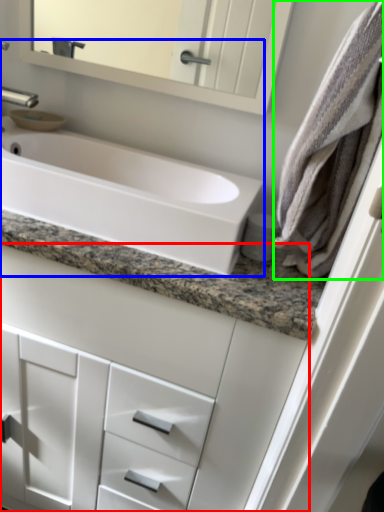
Question: Based on their relative distances, which object is farther from bathroom cabinet (highlighted by a red box)? Choose from sink (highlighted by a blue box) and bath towel (highlighted by a green box).

Choices:
 (A) sink
 (B) bath towel

Answer: (B)